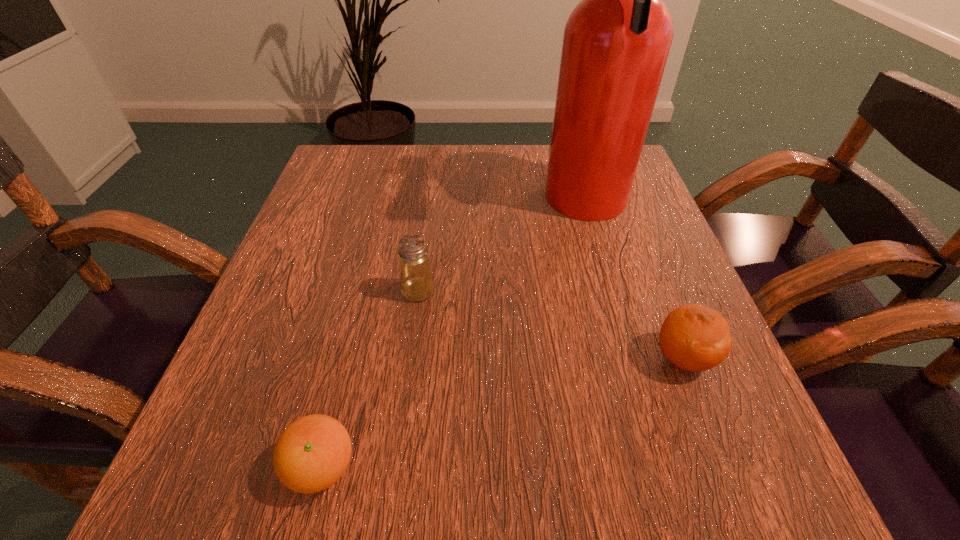
Identify the location of vacant space at the left edge of the desktop. (303, 318).

The image size is (960, 540). I want to click on free space at the right edge, so click(x=607, y=252).

At what (x,y) coordinates should I click in order to perform the action: click on free space at the far left corner of the desktop. Please return your answer as a coordinate pair (x, y). Looking at the image, I should click on (387, 151).

Identify the location of free space at the near right corner of the desktop. (730, 443).

Where is `unoccupied area between the farthest object and the leftmost object`? The width and height of the screenshot is (960, 540). unoccupied area between the farthest object and the leftmost object is located at coordinates (454, 336).

You are a GUI agent. You are given a task and a screenshot of the screen. Output one action in this format:
    pyautogui.click(x=<x>, y=<y>)
    Task: Click on the free space between the shortest object and the tallest object
    Image resolution: width=960 pixels, height=540 pixels.
    Given the screenshot: What is the action you would take?
    pyautogui.click(x=454, y=336)

Where is `free space between the farther orange and the nearer orange`? The width and height of the screenshot is (960, 540). free space between the farther orange and the nearer orange is located at coordinates pos(502,413).

Where is `empty location between the shorter orange and the fire extinguisher`? This screenshot has width=960, height=540. empty location between the shorter orange and the fire extinguisher is located at coordinates (454, 336).

Find the location of a particular element. This screenshot has width=960, height=540. empty space between the left orange and the saltshaker is located at coordinates click(x=370, y=379).

You are a GUI agent. You are given a task and a screenshot of the screen. Output one action in this format:
    pyautogui.click(x=<x>, y=<y>)
    Task: Click on the free space that is in between the left orange and the third nearest object
    The width and height of the screenshot is (960, 540).
    Given the screenshot: What is the action you would take?
    pyautogui.click(x=370, y=379)